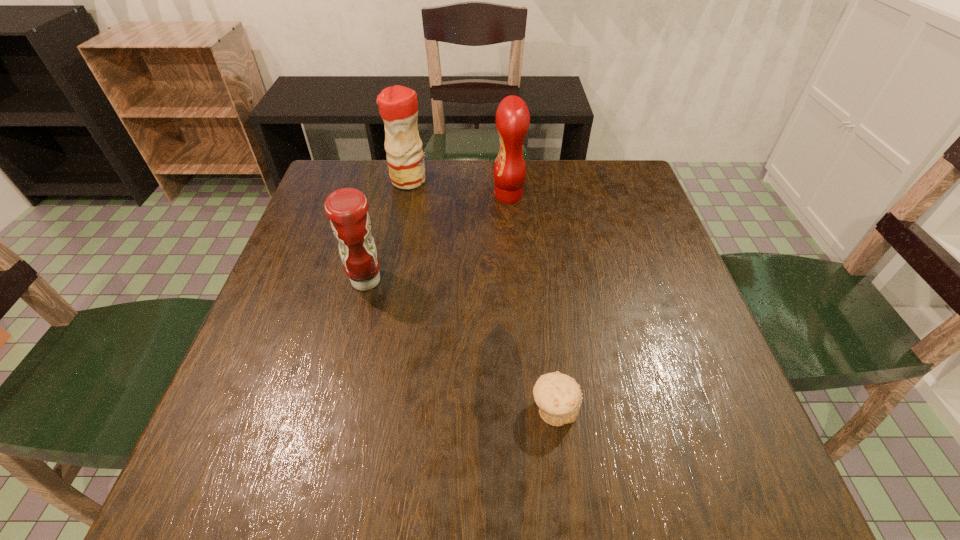
Image resolution: width=960 pixels, height=540 pixels. In order to click on object present at the left edge in this screenshot , I will do 347,208.

This screenshot has width=960, height=540. What are the coordinates of `free region at the far edge of the desktop` in the screenshot? It's located at (522, 198).

In the image, there is a desktop. What are the coordinates of `vacant space at the near edge` in the screenshot? It's located at (515, 487).

The height and width of the screenshot is (540, 960). In order to click on free spot at the left edge of the desktop in this screenshot , I will do 324,219.

In the image, there is a desktop. What are the coordinates of `vacant area at the right edge` in the screenshot? It's located at (640, 317).

The width and height of the screenshot is (960, 540). I want to click on vacant region at the far left corner, so click(x=322, y=188).

Locate an element on the screen. The image size is (960, 540). free spot at the far right corner of the desktop is located at coordinates (621, 178).

This screenshot has height=540, width=960. I want to click on free space at the near right corner of the desktop, so point(735,462).

I want to click on unoccupied area between the second nearest object and the rightmost condiment, so click(x=438, y=238).

I want to click on unoccupied position between the rightmost condiment and the muffin, so click(532, 302).